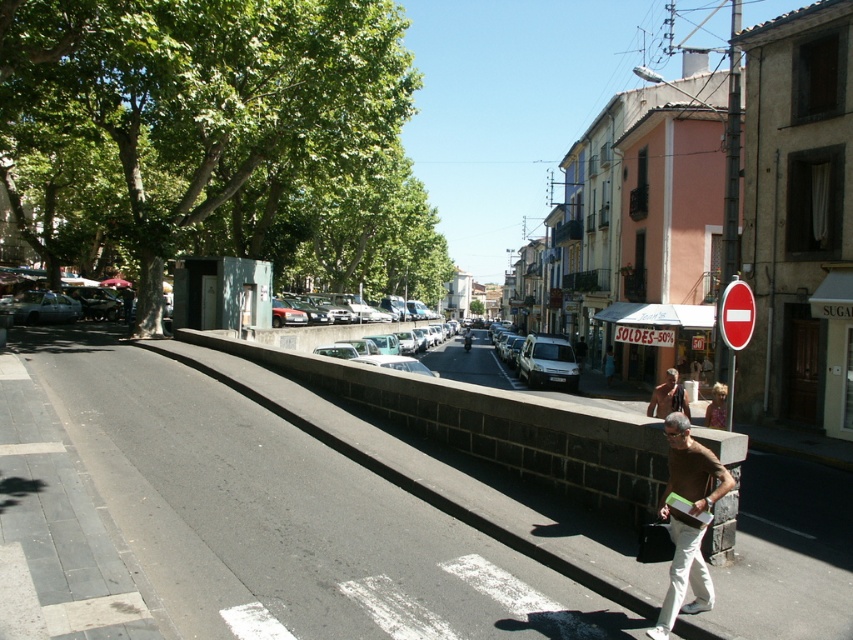
You are a tourist standing on the street looking at the brown cotton shirt at lower right and the red plastic sign at center right. Which object is shorter?

The brown cotton shirt at lower right is shorter than the red plastic sign at center right.

You are a tourist standing on the street in the European town. You see a brown cotton shirt at lower right and a brown leather jacket at center. Which one is positioned more to the left?

The brown cotton shirt at lower right is positioned more to the left than the brown leather jacket at center according to the description.

You are a delivery person with a 30 feet long ladder that needs to be placed between the brown cotton shirt at lower right and the brown leather jacket at center. Can the ladder fit between them without overlapping either object?

The brown cotton shirt at lower right and brown leather jacket at center are 28.32 feet apart. Since the ladder is 30 feet long, it cannot fit between them without overlapping either object because the distance between the two objects is shorter than the ladder.